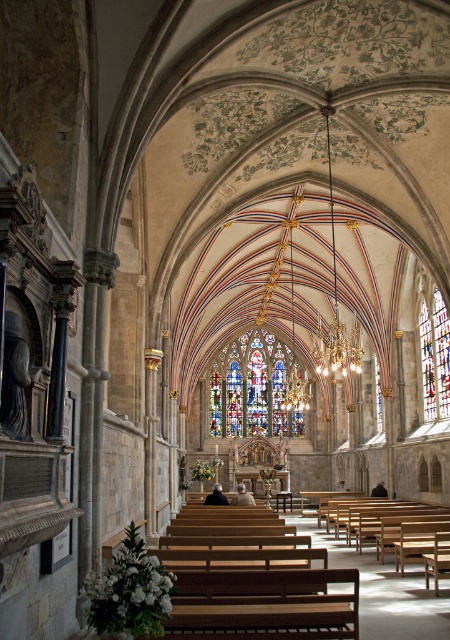
You are an architect visiting the church and want to compare the stained glass windows. Which of the two stained glass windows, the stained glass at center or the multicolored stained glass at right, is larger in size?

The stained glass at center is bigger than the multicolored stained glass at right, so the stained glass at center is larger in size.